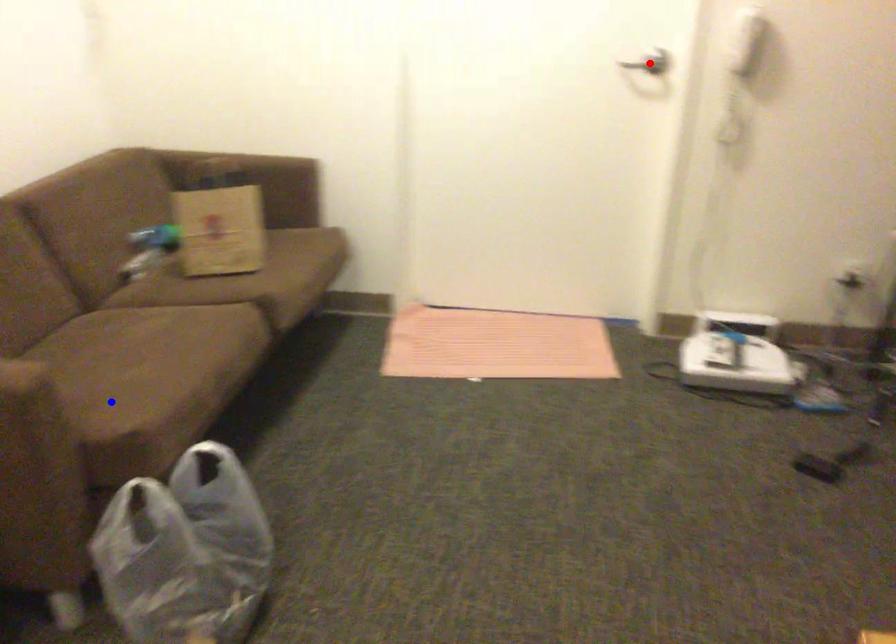
Question: In the image, two points are highlighted. Which point is nearer to the camera? Reply with the corresponding letter.

Choices:
 (A) blue point
 (B) red point

Answer: (A)